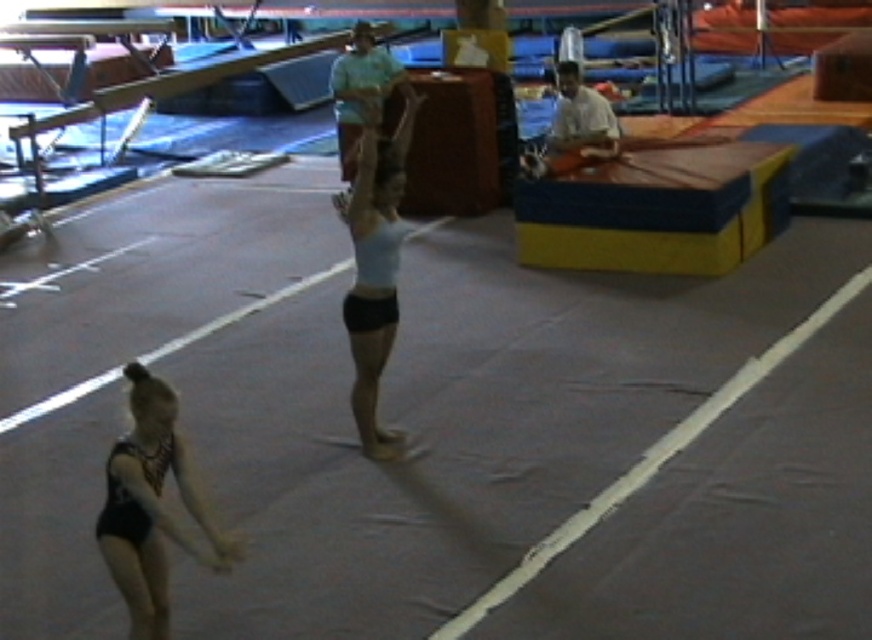
Is black leotard at lower left to the right of light blue fabric at center from the viewer's perspective?

Incorrect, black leotard at lower left is not on the right side of light blue fabric at center.

What do you see at coordinates (151, 506) in the screenshot?
I see `black leotard at lower left` at bounding box center [151, 506].

Image resolution: width=872 pixels, height=640 pixels. Find the location of `black leotard at lower left`. black leotard at lower left is located at coordinates (151, 506).

Locate an element on the screen. This screenshot has width=872, height=640. black leotard at lower left is located at coordinates (151, 506).